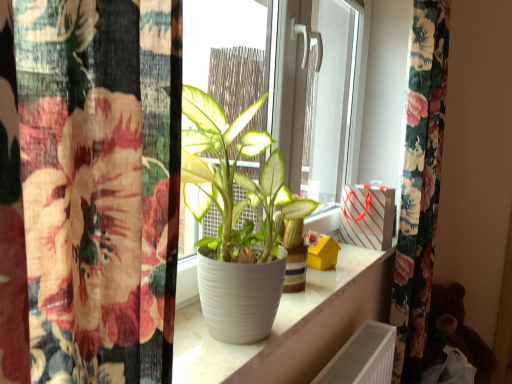
Question: Is white striped paper bag at upper right placed right next to white glossy pot at center?

Choices:
 (A) yes
 (B) no

Answer: (B)

Question: Considering the relative sizes of white striped paper bag at upper right and white glossy pot at center in the image provided, is white striped paper bag at upper right smaller than white glossy pot at center?

Choices:
 (A) no
 (B) yes

Answer: (B)

Question: Is white striped paper bag at upper right not inside white glossy pot at center?

Choices:
 (A) yes
 (B) no

Answer: (A)

Question: Could you tell me if white striped paper bag at upper right is facing white glossy pot at center?

Choices:
 (A) yes
 (B) no

Answer: (B)

Question: Does white striped paper bag at upper right lie behind white glossy pot at center?

Choices:
 (A) no
 (B) yes

Answer: (B)

Question: Considering the relative sizes of white striped paper bag at upper right and white glossy pot at center in the image provided, is white striped paper bag at upper right taller than white glossy pot at center?

Choices:
 (A) no
 (B) yes

Answer: (B)

Question: From a real-world perspective, is white matte pot at center positioned over white glossy pot at center based on gravity?

Choices:
 (A) yes
 (B) no

Answer: (A)

Question: Is white matte pot at center positioned far away from white glossy pot at center?

Choices:
 (A) yes
 (B) no

Answer: (B)

Question: Is white matte pot at center not inside white glossy pot at center?

Choices:
 (A) yes
 (B) no

Answer: (A)

Question: Is white matte pot at center wider than white glossy pot at center?

Choices:
 (A) yes
 (B) no

Answer: (B)

Question: Considering the relative positions of white matte pot at center and white glossy pot at center in the image provided, is white matte pot at center in front of white glossy pot at center?

Choices:
 (A) no
 (B) yes

Answer: (B)

Question: Can white glossy pot at center be found inside white matte pot at center?

Choices:
 (A) yes
 (B) no

Answer: (B)

Question: Could you tell me if white striped paper bag at upper right is turned towards white matte pot at center?

Choices:
 (A) no
 (B) yes

Answer: (A)